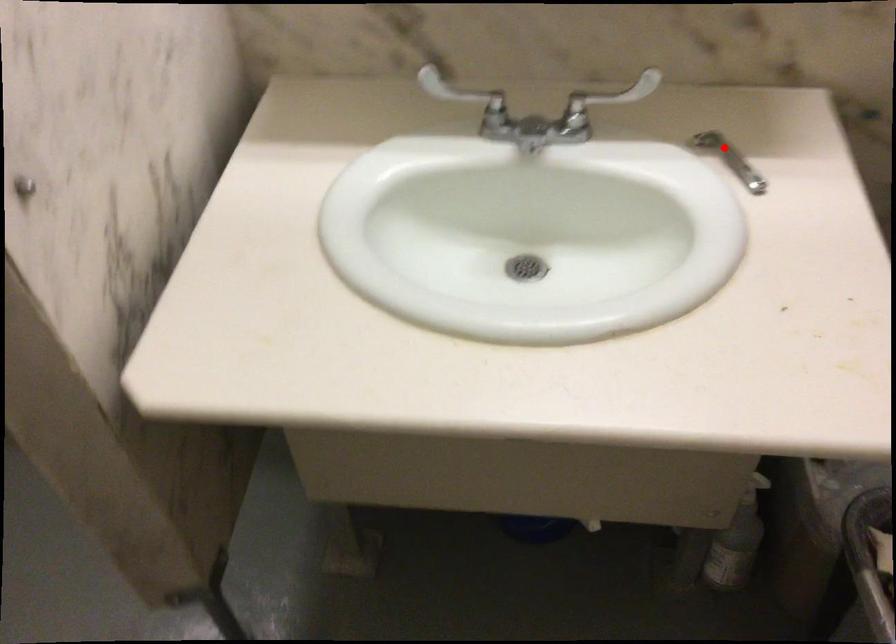
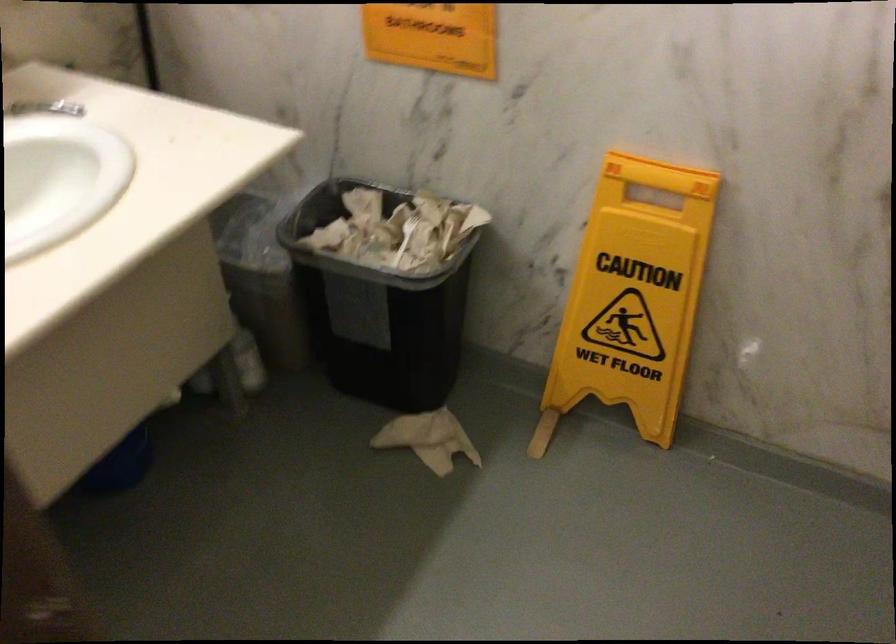
The point at the highlighted location is marked in the first image. Where is the corresponding point in the second image?

(45, 108)